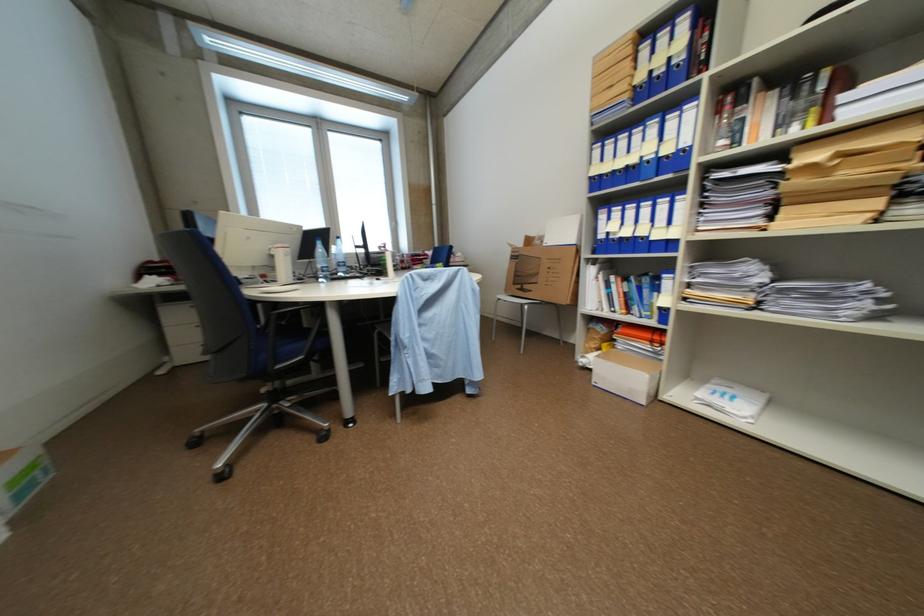
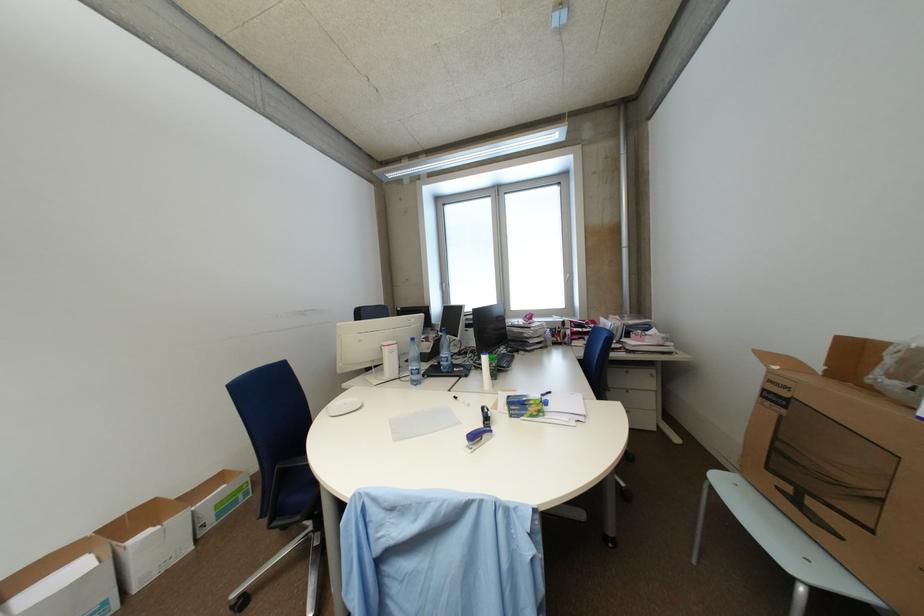
Locate, in the second image, the point that corresponds to the point at 332,272 in the first image.

(420, 375)